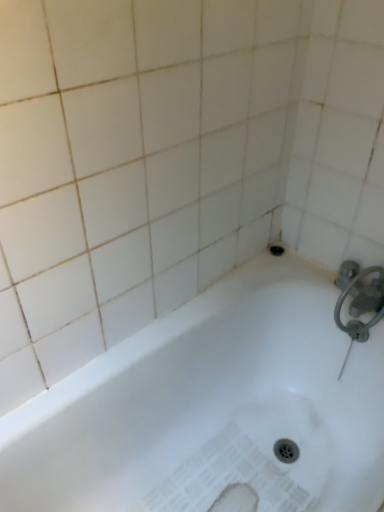
What do you see at coordinates (206, 398) in the screenshot? I see `white glossy bathtub at center` at bounding box center [206, 398].

Measure the distance between white glossy bathtub at center and camera.

33.77 inches.

You are a GUI agent. You are given a task and a screenshot of the screen. Output one action in this format:
    pyautogui.click(x=<x>, y=<y>)
    Task: Click on the white glossy bathtub at center
    
    Given the screenshot: What is the action you would take?
    pyautogui.click(x=206, y=398)

I want to click on white glossy bathtub at center, so click(x=206, y=398).